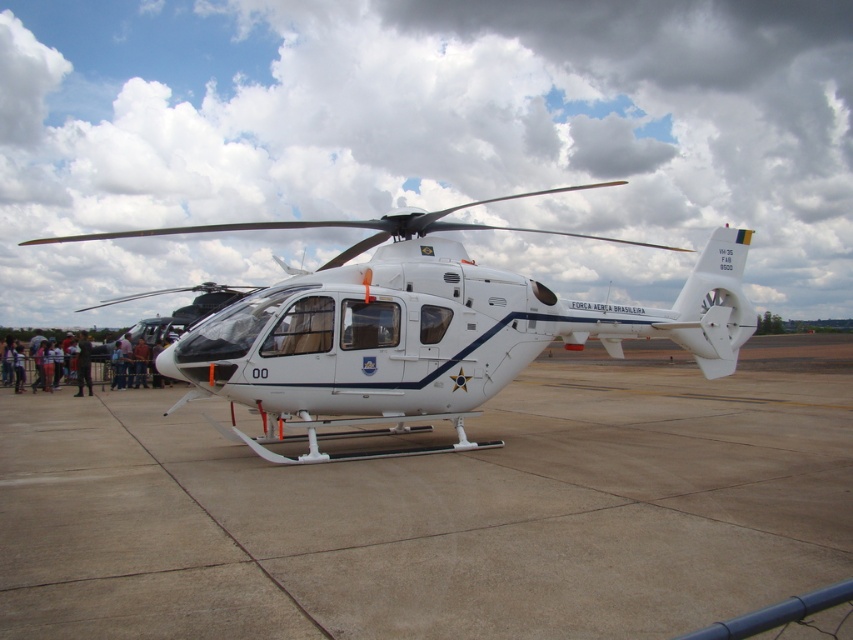
You are standing at the edge of the airfield and see the smooth concrete tarmac at center and the dark blue fabric pants at lower left. Which object is positioned to the right of the other?

The smooth concrete tarmac at center is to the right of the dark blue fabric pants at lower left.

In the scene shown: You are a drone operator trying to land a drone on the tarmac. The drone must land precisely on the smooth concrete tarmac at center. Given that the drone is currently hovering at point coordinates of [440,509], is the drone already positioned over the smooth concrete tarmac at center?

Yes, the drone is already positioned over the smooth concrete tarmac at center because the point coordinates [440,509] correspond to the smooth concrete tarmac at center.